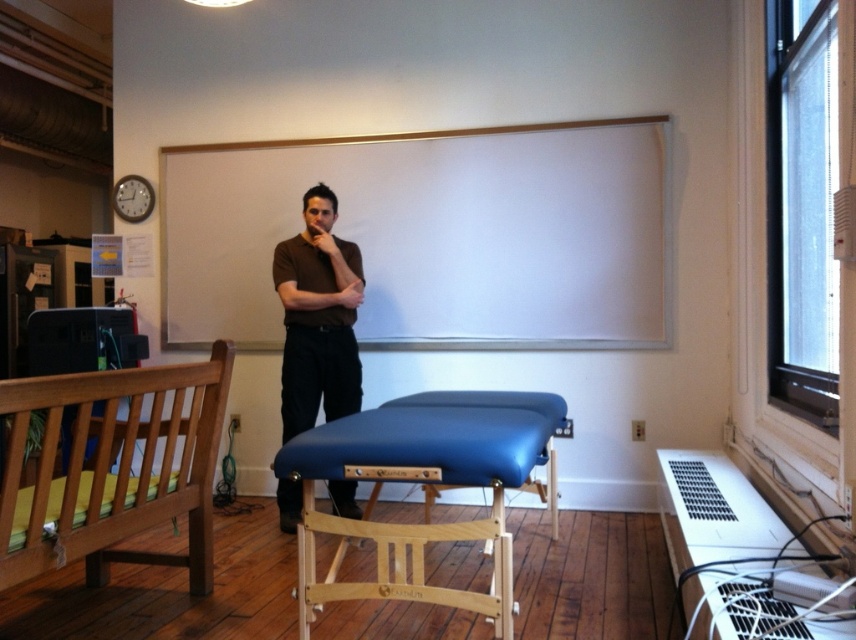
Is point (198, 387) behind point (302, 278)?

That is False.

Based on the photo, who is positioned more to the left, wooden bench at left or brown matte shirt at center?

wooden bench at left is more to the left.

Which is in front, point (94, 525) or point (288, 292)?

Point (94, 525) is in front.

Locate an element on the screen. wooden bench at left is located at coordinates (111, 472).

Is blue leather stool at center shorter than brown matte shirt at center?

Yes.

This screenshot has width=856, height=640. In order to click on blue leather stool at center in this screenshot , I will do pos(421,483).

Describe the element at coordinates (318, 317) in the screenshot. I see `brown matte shirt at center` at that location.

Does brown matte shirt at center appear on the left side of dark brown shirt at center?

Indeed, brown matte shirt at center is positioned on the left side of dark brown shirt at center.

Is point (325, 300) positioned behind point (290, 292)?

Yes, it is behind point (290, 292).

The height and width of the screenshot is (640, 856). I want to click on brown matte shirt at center, so click(318, 317).